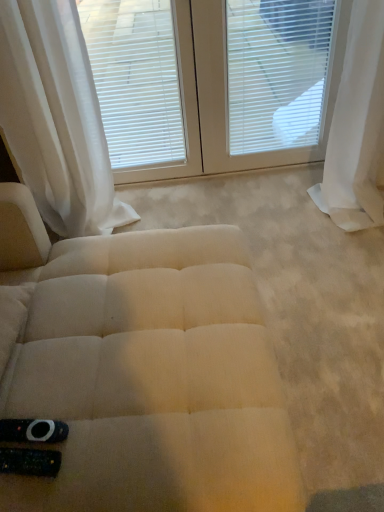
Question: Relative to white sheer curtain at upper left, placed as the 1th curtain when sorted from left to right, is white textured blinds at upper center in front or behind?

Choices:
 (A) behind
 (B) front

Answer: (A)

Question: Is white textured blinds at upper center bigger or smaller than white sheer curtain at upper left, placed as the 1th curtain when sorted from left to right?

Choices:
 (A) big
 (B) small

Answer: (B)

Question: Estimate the real-world distances between objects in this image. Which object is closer to the white sheer curtain at right, the first curtain viewed from the right?

Choices:
 (A) beige fabric ottoman at center
 (B) white textured blinds at upper center
 (C) white matte window blind at upper center
 (D) white plastic blinds at upper center
 (E) white sheer curtain at upper left, placed as the 1th curtain when sorted from left to right

Answer: (D)

Question: Estimate the real-world distances between objects in this image. Which object is closer to the beige fabric ottoman at center?

Choices:
 (A) white plastic blinds at upper center
 (B) white sheer curtain at right, the second curtain positioned from the left
 (C) white matte window blind at upper center
 (D) white textured blinds at upper center
 (E) white sheer curtain at upper left, placed as the 1th curtain when sorted from left to right

Answer: (E)